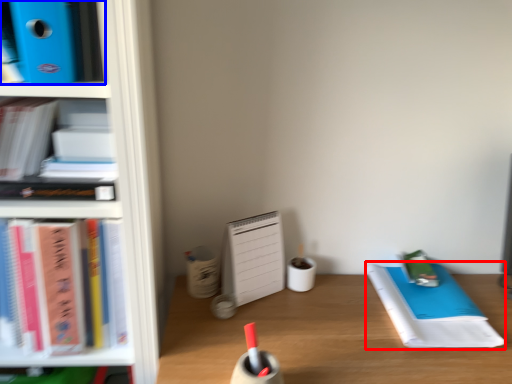
Question: Which object appears closest to the camera in this image, notebook (highlighted by a red box) or book (highlighted by a blue box)?

Choices:
 (A) notebook
 (B) book

Answer: (B)